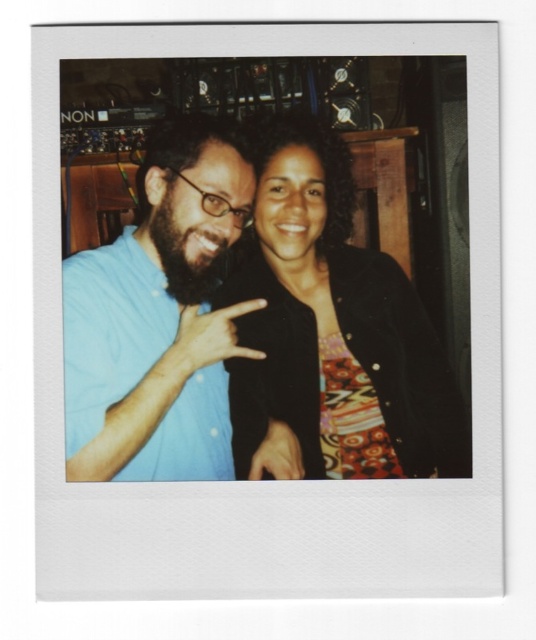
Who is higher up, black textured jacket at center or blue cotton shirt at center?

blue cotton shirt at center

Is point (307, 472) closer to camera compared to point (84, 292)?

Yes, it is in front of point (84, 292).

The width and height of the screenshot is (536, 640). I want to click on black textured jacket at center, so point(331,332).